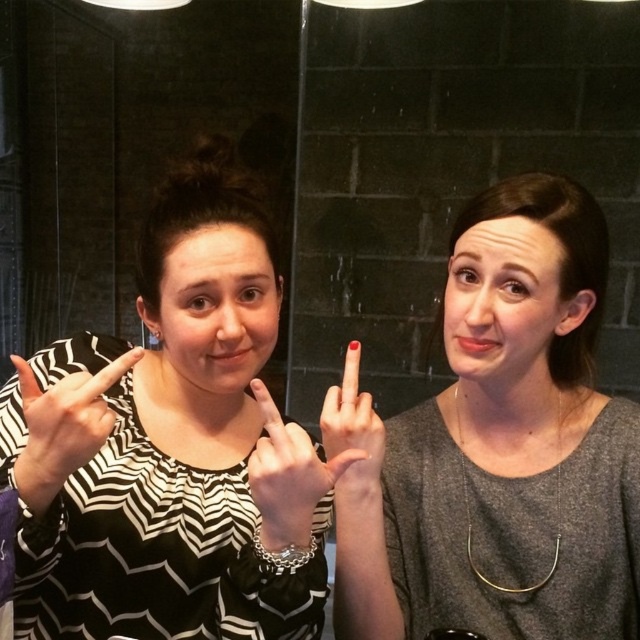
Question: Is matte gray shirt at center further to camera compared to nail polish at middle finger at center?

Choices:
 (A) yes
 (B) no

Answer: (A)

Question: Can you confirm if black and white striped shirt at left is smaller than zebra-patterned shirt sleeve at left?

Choices:
 (A) yes
 (B) no

Answer: (B)

Question: Which point is closer to the camera?

Choices:
 (A) (160, 381)
 (B) (76, 460)
 (C) (548, 572)
 (D) (266, 403)

Answer: (B)

Question: Which object is positioned farthest from the matte black hand at center?

Choices:
 (A) nail polish at middle finger at center
 (B) matte gray shirt at center
 (C) zebra-patterned shirt sleeve at left

Answer: (B)

Question: Which object is farther from the camera taking this photo?

Choices:
 (A) matte black hand at center
 (B) nail polish at middle finger at center

Answer: (B)

Question: Is black and white striped shirt at left closer to the viewer compared to nail polish at middle finger at center?

Choices:
 (A) yes
 (B) no

Answer: (A)